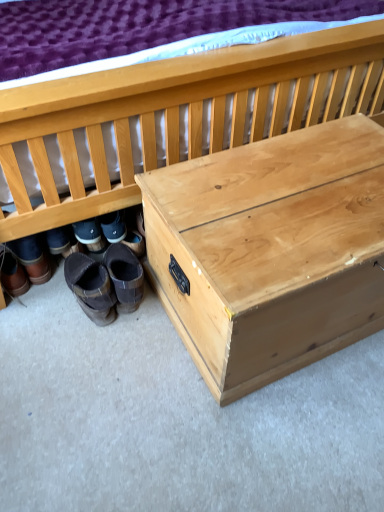
Describe the element at coordinates (89, 234) in the screenshot. I see `brown leather boots at lower left, acting as the 2th footwear starting from the left` at that location.

Image resolution: width=384 pixels, height=512 pixels. Identify the location of brown suede boots at lower left, acting as the 4th footwear starting from the left. (125, 276).

The image size is (384, 512). What do you see at coordinates (271, 251) in the screenshot?
I see `natural wood trunk at center` at bounding box center [271, 251].

Locate an element on the screen. brown leather boots at lower left, the 4th footwear from the right is located at coordinates (12, 273).

Locate an element on the screen. The width and height of the screenshot is (384, 512). brown leather boots at lower left, which is the third footwear from right to left is located at coordinates (89, 234).

What's the angular difference between brown leather boots at lower left, which is the third footwear from right to left, and brown suede boots at lower left, which ranks as the second footwear in right-to-left order,'s facing directions?

0.115 degrees separate the facing orientations of brown leather boots at lower left, which is the third footwear from right to left, and brown suede boots at lower left, which ranks as the second footwear in right-to-left order.

Does brown leather boots at lower left, acting as the 2th footwear starting from the left, turn towards brown suede boots at lower left, which is counted as the third footwear, starting from the left?

No, brown leather boots at lower left, acting as the 2th footwear starting from the left, is not turned towards brown suede boots at lower left, which is counted as the third footwear, starting from the left.

Considering the relative positions of brown leather boots at lower left, which is the third footwear from right to left, and brown suede boots at lower left, which is counted as the third footwear, starting from the left, in the image provided, is brown leather boots at lower left, which is the third footwear from right to left, to the left of brown suede boots at lower left, which is counted as the third footwear, starting from the left, from the viewer's perspective?

Correct, you'll find brown leather boots at lower left, which is the third footwear from right to left, to the left of brown suede boots at lower left, which is counted as the third footwear, starting from the left.

Considering the sizes of brown leather boots at lower left, acting as the 2th footwear starting from the left, and brown suede boots at lower left, which is counted as the third footwear, starting from the left, in the image, is brown leather boots at lower left, acting as the 2th footwear starting from the left, wider or thinner than brown suede boots at lower left, which is counted as the third footwear, starting from the left,?

brown leather boots at lower left, acting as the 2th footwear starting from the left, is thinner than brown suede boots at lower left, which is counted as the third footwear, starting from the left.

Relative to brown suede boots at lower left, acting as the 4th footwear starting from the left, is natural wood trunk at center in front or behind?

In the image, natural wood trunk at center appears in front of brown suede boots at lower left, acting as the 4th footwear starting from the left.

Can brown suede boots at lower left, acting as the 4th footwear starting from the left, be found inside natural wood trunk at center?

No, brown suede boots at lower left, acting as the 4th footwear starting from the left, is not inside natural wood trunk at center.

How much distance is there between natural wood trunk at center and brown suede boots at lower left, acting as the 4th footwear starting from the left?

natural wood trunk at center and brown suede boots at lower left, acting as the 4th footwear starting from the left, are 19.37 inches apart.

Can you see natural wood trunk at center touching brown suede boots at lower left, the first footwear from the right?

natural wood trunk at center is not next to brown suede boots at lower left, the first footwear from the right, and they're not touching.

Is brown leather boots at lower left, which is the third footwear from right to left, turned away from brown suede boots at lower left, the first footwear from the right?

Yes, brown leather boots at lower left, which is the third footwear from right to left, is positioned with its back facing brown suede boots at lower left, the first footwear from the right.

Is brown leather boots at lower left, acting as the 2th footwear starting from the left, thinner than brown suede boots at lower left, the first footwear from the right?

Yes.

From a real-world perspective, is brown leather boots at lower left, acting as the 2th footwear starting from the left, positioned under brown suede boots at lower left, the first footwear from the right, based on gravity?

No, from a real-world perspective, brown leather boots at lower left, acting as the 2th footwear starting from the left, is not beneath brown suede boots at lower left, the first footwear from the right.

Are brown leather boots at lower left, which is the third footwear from right to left, and brown suede boots at lower left, acting as the 4th footwear starting from the left, making contact?

No, brown leather boots at lower left, which is the third footwear from right to left, is not next to brown suede boots at lower left, acting as the 4th footwear starting from the left.

Which footwear is the 2nd one when counting from the front of the brown leather boots at lower left, the 4th footwear from the right? Please provide its 2D coordinates.

[(91, 288)]

Consider the image. Is brown leather boots at lower left, the 4th footwear from the right, inside the boundaries of brown suede boots at lower left, which ranks as the second footwear in right-to-left order, or outside?

brown leather boots at lower left, the 4th footwear from the right, is not inside brown suede boots at lower left, which ranks as the second footwear in right-to-left order, it's outside.

Which of these two, brown leather boots at lower left, the 4th footwear from the right, or brown suede boots at lower left, which is counted as the third footwear, starting from the left, is smaller?

brown suede boots at lower left, which is counted as the third footwear, starting from the left.

Considering the relative positions of brown leather boots at lower left, the 4th footwear from the right, and brown suede boots at lower left, which is counted as the third footwear, starting from the left, in the image provided, is brown leather boots at lower left, the 4th footwear from the right, to the right of brown suede boots at lower left, which is counted as the third footwear, starting from the left, from the viewer's perspective?

In fact, brown leather boots at lower left, the 4th footwear from the right, is to the left of brown suede boots at lower left, which is counted as the third footwear, starting from the left.

Is brown suede boots at lower left, which ranks as the second footwear in right-to-left order, taller than brown leather boots at lower left, acting as the 2th footwear starting from the left?

Indeed, brown suede boots at lower left, which ranks as the second footwear in right-to-left order, has a greater height compared to brown leather boots at lower left, acting as the 2th footwear starting from the left.

Based on the photo, is brown suede boots at lower left, which is counted as the third footwear, starting from the left, completely or partially outside of brown leather boots at lower left, which is the third footwear from right to left?

Yes, brown suede boots at lower left, which is counted as the third footwear, starting from the left, is outside of brown leather boots at lower left, which is the third footwear from right to left.

Would you say brown suede boots at lower left, which is counted as the third footwear, starting from the left, is a long distance from brown leather boots at lower left, acting as the 2th footwear starting from the left?

No.

Looking at this image, which is closer, (99,325) or (103,246)?

Point (99,325)

Measure the distance between natural wood chest at lower right and brown suede boots at lower left, which is counted as the third footwear, starting from the left.

The distance of natural wood chest at lower right from brown suede boots at lower left, which is counted as the third footwear, starting from the left, is 20.21 inches.

Is natural wood chest at lower right facing towards brown suede boots at lower left, which is counted as the third footwear, starting from the left?

Yes, natural wood chest at lower right is facing brown suede boots at lower left, which is counted as the third footwear, starting from the left.

Can you confirm if natural wood chest at lower right is positioned to the left of brown suede boots at lower left, which ranks as the second footwear in right-to-left order?

No.

Is natural wood chest at lower right behind brown suede boots at lower left, which is counted as the third footwear, starting from the left?

That is False.

Is brown leather boots at lower left, the 4th footwear from the right, in front of or behind brown suede boots at lower left, the first footwear from the right, in the image?

brown leather boots at lower left, the 4th footwear from the right, is positioned farther from the viewer than brown suede boots at lower left, the first footwear from the right.

From the image's perspective, relative to brown suede boots at lower left, the first footwear from the right, is brown leather boots at lower left, the 4th footwear from the right, above or below?

Based on their image positions, brown leather boots at lower left, the 4th footwear from the right, is located above brown suede boots at lower left, the first footwear from the right.

Is point (18, 263) closer or farther from the camera than point (127, 286)?

Point (18, 263).

Locate an element on the screen. the 1st footwear positioned above the brown suede boots at lower left, which ranks as the second footwear in right-to-left order (from a real-world perspective) is located at coordinates (89, 234).

Identify the location of table that is in front of the brown suede boots at lower left, acting as the 4th footwear starting from the left. (271, 251).

From the image, which object appears to be farther from brown suede boots at lower left, which ranks as the second footwear in right-to-left order, brown suede boots at lower left, acting as the 4th footwear starting from the left, or brown leather boots at lower left, the 4th footwear from the right?

brown leather boots at lower left, the 4th footwear from the right, is further to brown suede boots at lower left, which ranks as the second footwear in right-to-left order.

Estimate the real-world distances between objects in this image. Which object is further from natural wood trunk at center, brown suede boots at lower left, which is counted as the third footwear, starting from the left, or natural wood chest at lower right?

The object further to natural wood trunk at center is brown suede boots at lower left, which is counted as the third footwear, starting from the left.

When comparing their distances from brown suede boots at lower left, acting as the 4th footwear starting from the left, does brown leather boots at lower left, which is the first footwear in left-to-right order, or natural wood chest at lower right seem closer?

Based on the image, brown leather boots at lower left, which is the first footwear in left-to-right order, appears to be nearer to brown suede boots at lower left, acting as the 4th footwear starting from the left.

From the image, which object appears to be nearer to brown leather boots at lower left, which is the third footwear from right to left, brown suede boots at lower left, which ranks as the second footwear in right-to-left order, or brown leather boots at lower left, the 4th footwear from the right?

The object closer to brown leather boots at lower left, which is the third footwear from right to left, is brown suede boots at lower left, which ranks as the second footwear in right-to-left order.

Which object lies nearer to the anchor point natural wood chest at lower right, brown suede boots at lower left, the first footwear from the right, or brown suede boots at lower left, which is counted as the third footwear, starting from the left?

Based on the image, brown suede boots at lower left, the first footwear from the right, appears to be nearer to natural wood chest at lower right.

Looking at the image, which one is located further to brown leather boots at lower left, which is the first footwear in left-to-right order, brown suede boots at lower left, which ranks as the second footwear in right-to-left order, or brown suede boots at lower left, the first footwear from the right?

brown suede boots at lower left, the first footwear from the right.

From the image, which object appears to be nearer to brown leather boots at lower left, which is the first footwear in left-to-right order, brown suede boots at lower left, which ranks as the second footwear in right-to-left order, or natural wood chest at lower right?

brown suede boots at lower left, which ranks as the second footwear in right-to-left order, is positioned closer to the anchor brown leather boots at lower left, which is the first footwear in left-to-right order.

Consider the image. Which object lies nearer to the anchor point natural wood trunk at center, brown leather boots at lower left, acting as the 2th footwear starting from the left, or natural wood chest at lower right?

natural wood chest at lower right is closer to natural wood trunk at center.

Locate an element on the screen. Image resolution: width=384 pixels, height=512 pixels. footwear that lies between natural wood chest at lower right and brown leather boots at lower left, which is the first footwear in left-to-right order, from top to bottom is located at coordinates (89, 234).

This screenshot has width=384, height=512. Identify the location of footwear located between brown leather boots at lower left, which is the first footwear in left-to-right order, and brown suede boots at lower left, which ranks as the second footwear in right-to-left order, in the left-right direction. (89, 234).

This screenshot has height=512, width=384. I want to click on table between natural wood chest at lower right and brown leather boots at lower left, the 4th footwear from the right, vertically, so 271,251.

Find the location of a particular element. The width and height of the screenshot is (384, 512). table that lies between natural wood chest at lower right and brown suede boots at lower left, acting as the 4th footwear starting from the left, from top to bottom is located at coordinates (271, 251).